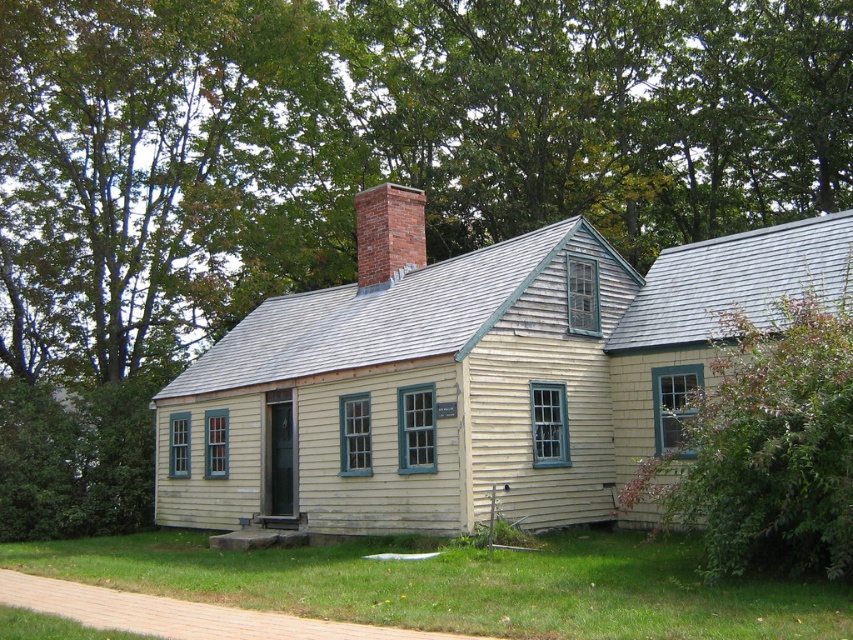
You are standing in front of the house and want to plant a new flower bed. The flower bed needs to be placed below the brick chimney at center. Is the green leafy bush at right already occupying that space?

The green leafy bush at right is located below the brick chimney at center, so it is already occupying the desired space for the flower bed.

You are standing in front of the house and notice the green leafy bush at right and the brick chimney at center. Which object is positioned more to the east side of the house?

The green leafy bush at right is positioned to the right of the brick chimney at center, so it is more to the east side of the house.